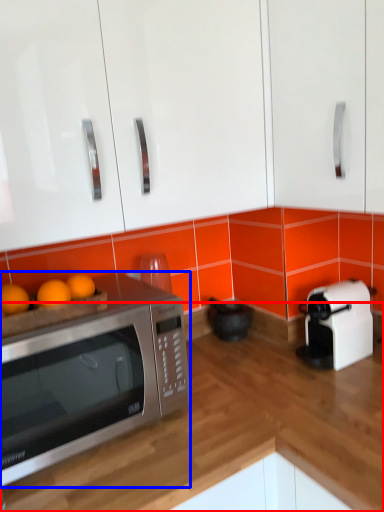
Question: Which of the following is the farthest to the observer, counter top (highlighted by a red box) or microwave oven (highlighted by a blue box)?

Choices:
 (A) counter top
 (B) microwave oven

Answer: (B)